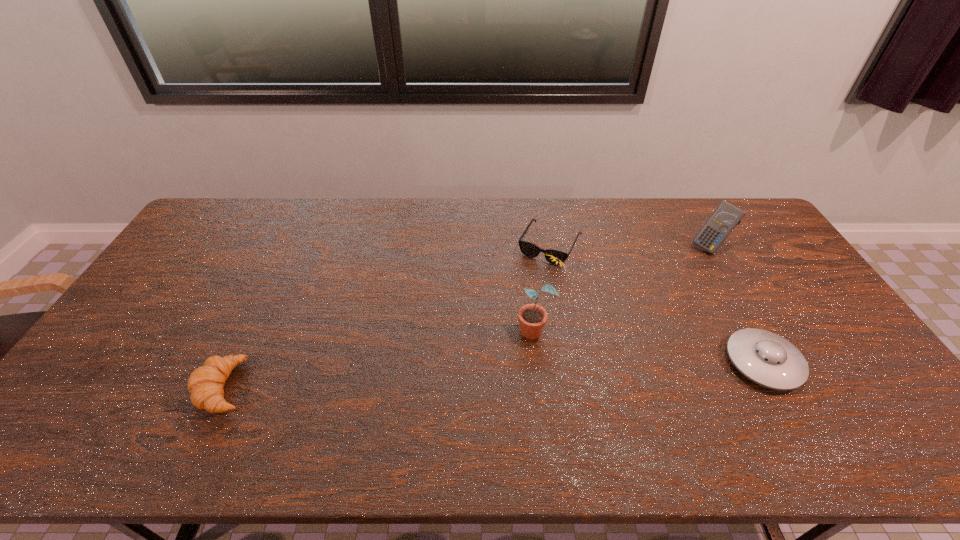
Image resolution: width=960 pixels, height=540 pixels. Find the location of `vacant area between the sunflower and the saucer`. vacant area between the sunflower and the saucer is located at coordinates (651, 345).

Where is `empty space between the calculator and the sunglasses`? empty space between the calculator and the sunglasses is located at coordinates (630, 246).

Point out which object is positioned as the third nearest to the crescent roll. Please provide its 2D coordinates. Your answer should be formatted as a tuple, i.e. [(x, y)], where the tuple contains the x and y coordinates of a point satisfying the conditions above.

[(766, 358)]

Identify which object is located as the second nearest to the crescent roll. Please provide its 2D coordinates. Your answer should be formatted as a tuple, i.e. [(x, y)], where the tuple contains the x and y coordinates of a point satisfying the conditions above.

[(529, 249)]

Find the location of `blank area in the image that satisfies the following two spatial constraints: 1. on the back side of the crescent roll; 2. on the left side of the sunglasses`. blank area in the image that satisfies the following two spatial constraints: 1. on the back side of the crescent roll; 2. on the left side of the sunglasses is located at coordinates (292, 245).

Identify the location of free space that satisfies the following two spatial constraints: 1. on the back side of the leftmost object; 2. on the right side of the sunglasses. The image size is (960, 540). (292, 245).